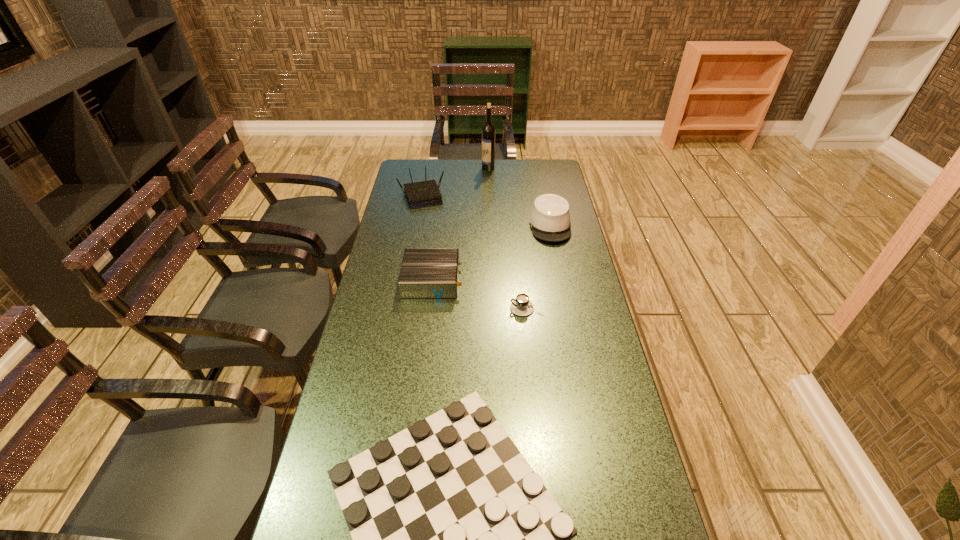
This screenshot has width=960, height=540. Find the location of `the farthest object`. the farthest object is located at coordinates (488, 131).

Locate an element on the screen. Image resolution: width=960 pixels, height=540 pixels. the tallest object is located at coordinates (488, 131).

Locate an element on the screen. the taller router is located at coordinates (422, 194).

The height and width of the screenshot is (540, 960). I want to click on hat, so click(549, 220).

The height and width of the screenshot is (540, 960). What are the coordinates of `the shorter router` in the screenshot? It's located at (425, 272).

Identify the location of the nearer router. (425, 272).

Locate an element on the screen. This screenshot has width=960, height=540. cappuccino is located at coordinates (521, 306).

I want to click on the fifth tallest object, so click(521, 306).

What are the coordinates of `free space located on the label of the tallest object` in the screenshot? It's located at (443, 168).

Where is `free space located 0.080m on the label of the tallest object`? free space located 0.080m on the label of the tallest object is located at coordinates (465, 168).